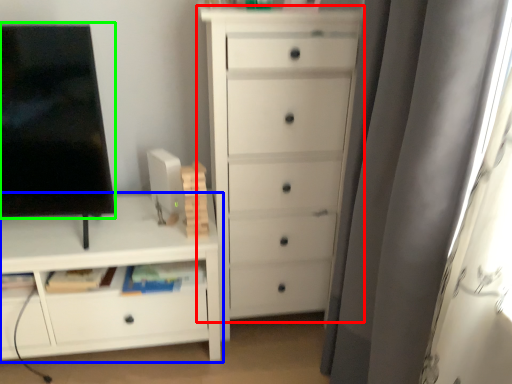
Question: Which object is positioned closest to chest of drawers (highlighted by a red box)? Select from chest of drawers (highlighted by a blue box) and screen (highlighted by a green box).

Choices:
 (A) chest of drawers
 (B) screen

Answer: (A)